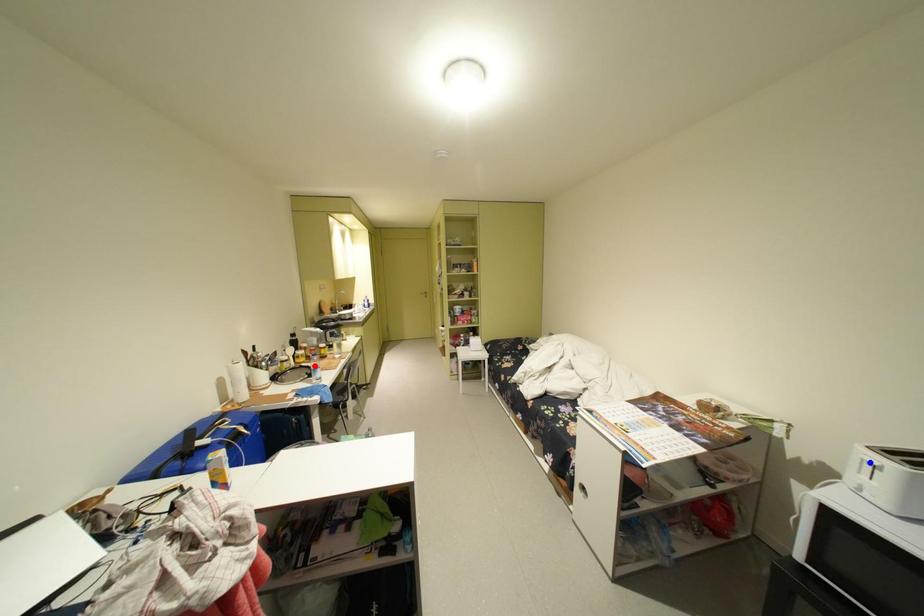
Question: In the image, two points are highlighted. Which point is nearer to the camera? Reply with the corresponding letter.

Choices:
 (A) blue point
 (B) red point

Answer: (A)